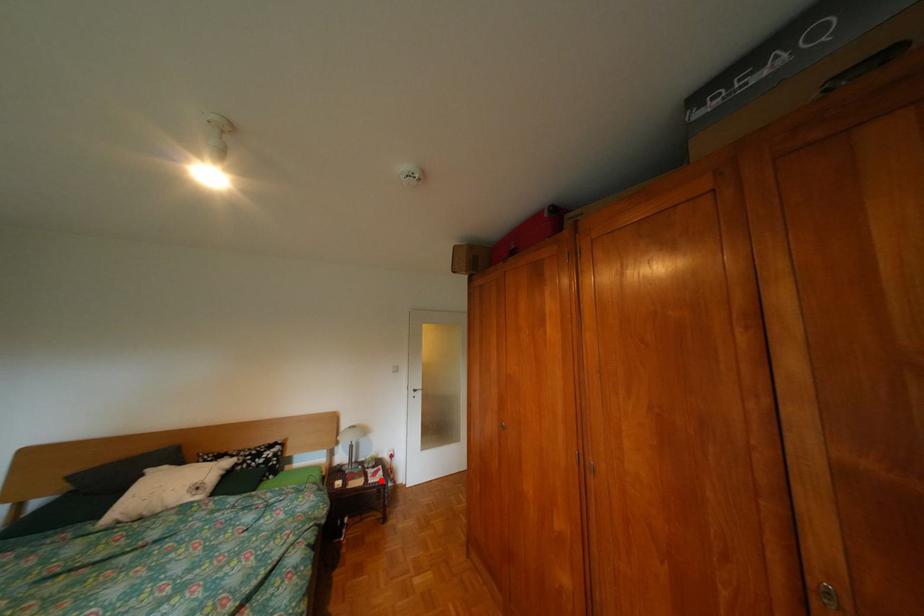
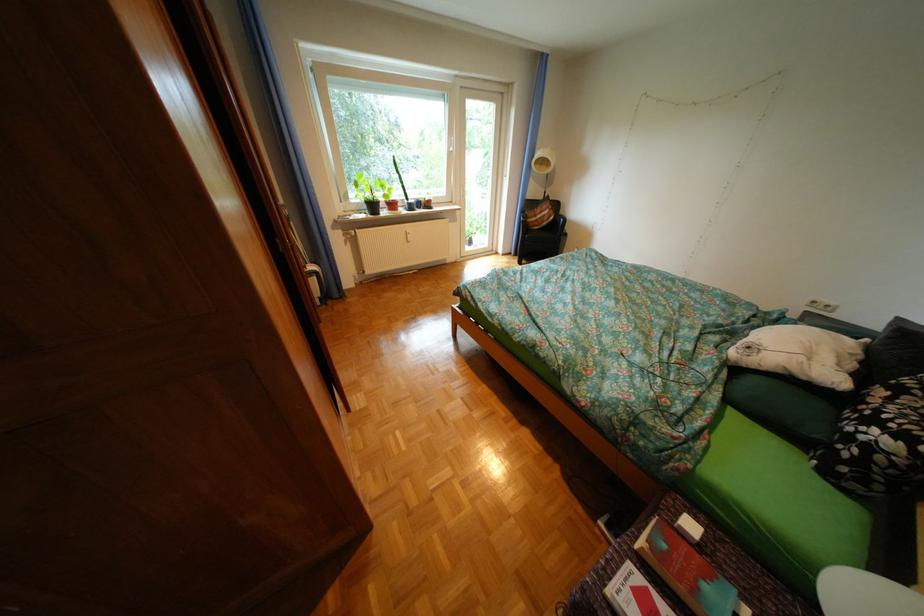
Question: I am providing you with two images of the same scene from different viewpoints. A red point is shown in image1. For the corresponding object point in image2, is it positioned nearer or farther from the camera?

Choices:
 (A) Nearer
 (B) Farther

Answer: (B)